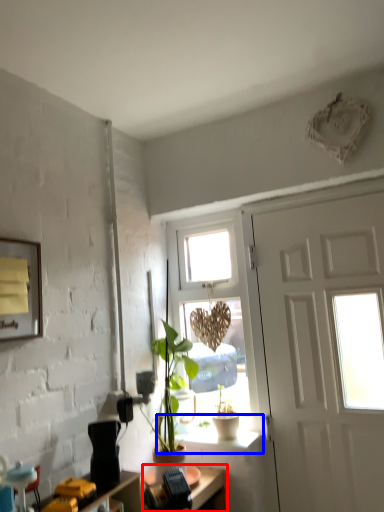
Question: Which object appears closest to the camera in this image, desk (highlighted by a red box) or window sill (highlighted by a blue box)?

Choices:
 (A) desk
 (B) window sill

Answer: (A)